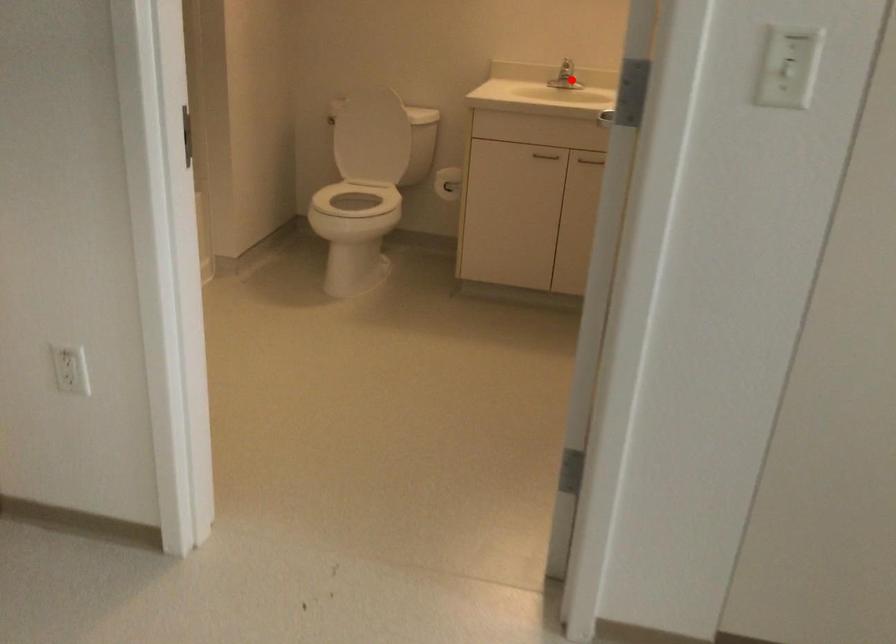
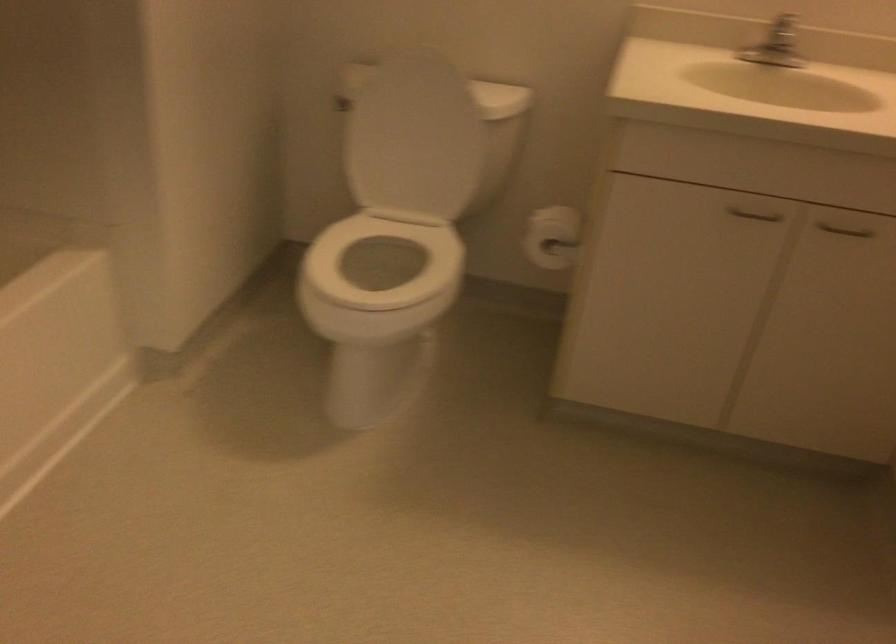
Question: I am providing you with two images of the same scene from different viewpoints. In image1, a red point is highlighted. Considering the same 3D point in image2, which of the following is correct?

Choices:
 (A) It is closer
 (B) It is farther

Answer: (A)